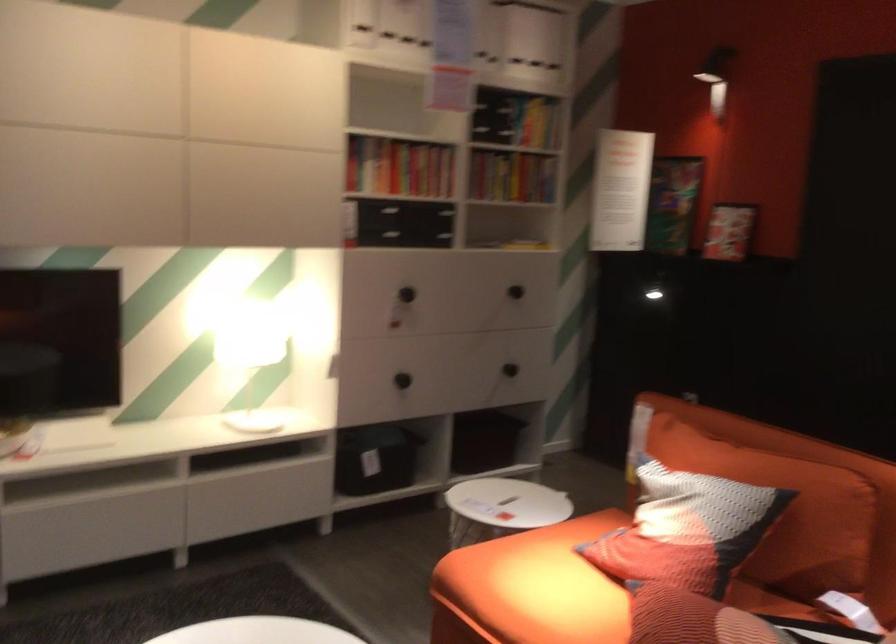
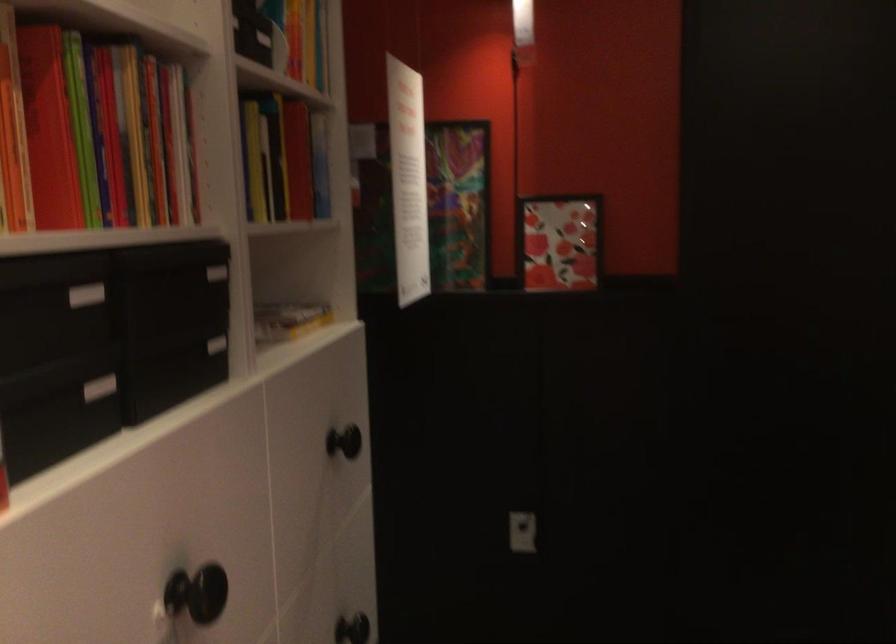
The point at (688, 178) is marked in the first image. Where is the corresponding point in the second image?

(458, 204)